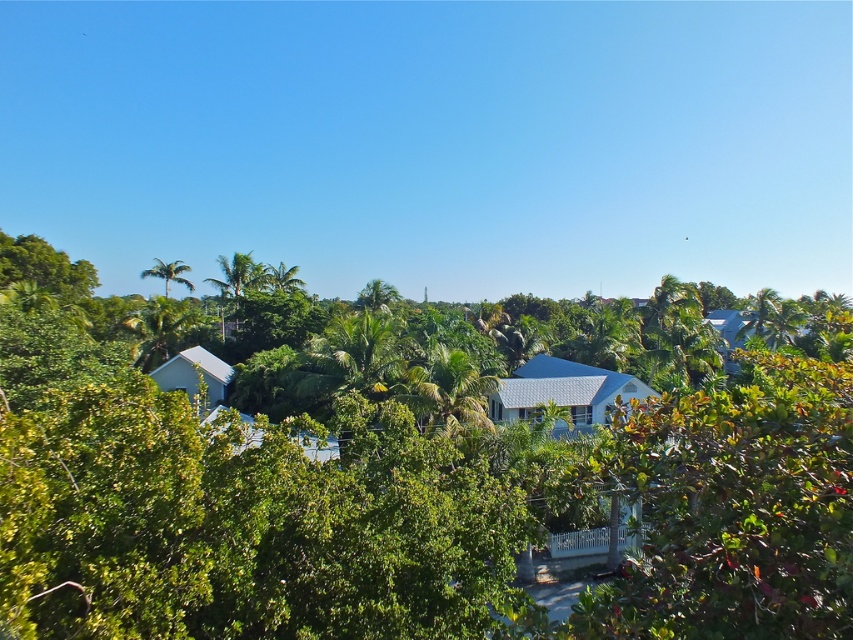
Question: Is green leafy tree at center above green leafy palm tree at upper left?

Choices:
 (A) yes
 (B) no

Answer: (B)

Question: Is green leafy tree at center thinner than green leafy palm tree at upper left?

Choices:
 (A) yes
 (B) no

Answer: (B)

Question: Where is green leafy tree at center located in relation to green leafy palm tree at upper left in the image?

Choices:
 (A) right
 (B) left

Answer: (A)

Question: Which object appears farthest from the camera in this image?

Choices:
 (A) green leafy tree at center
 (B) green leafy palm tree at upper left

Answer: (B)